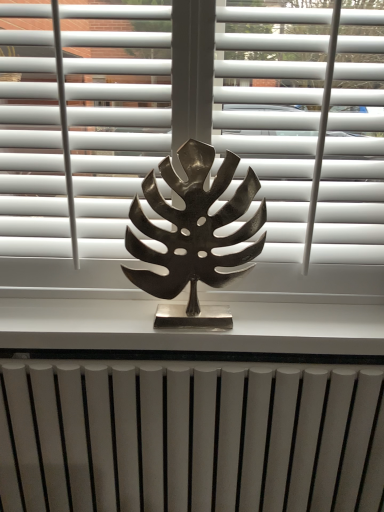
Image resolution: width=384 pixels, height=512 pixels. Identify the location of free location to the right of bronze leaf at center. (278, 321).